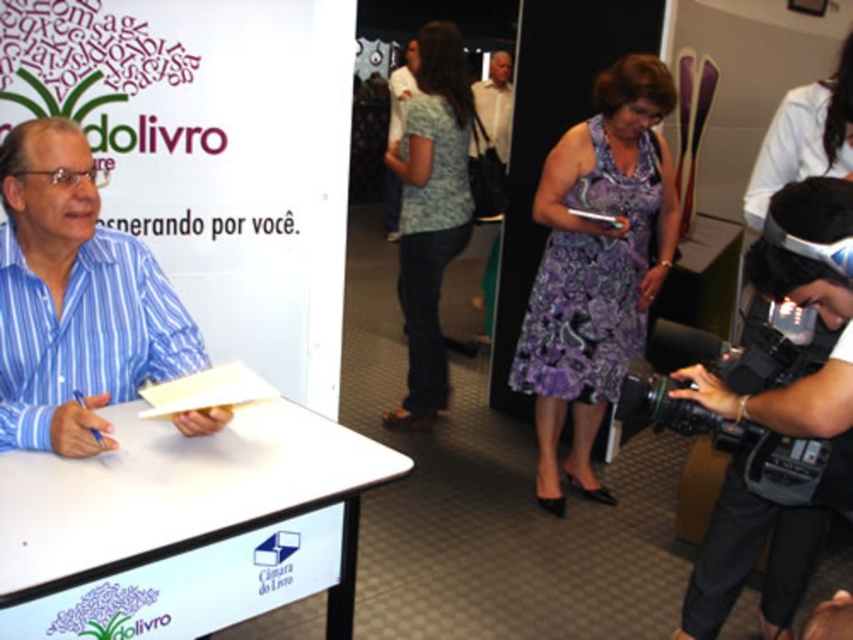
The image size is (853, 640). What do you see at coordinates (74, 300) in the screenshot?
I see `blue striped shirt at left` at bounding box center [74, 300].

Who is more forward, (x=49, y=244) or (x=682, y=410)?

Point (x=49, y=244) is more forward.

Between point (13, 214) and point (686, 435), which one is positioned in front?

Point (13, 214)

Locate an element on the screen. The width and height of the screenshot is (853, 640). blue striped shirt at left is located at coordinates (74, 300).

From the picture: Between blue striped shirt at left and purple printed dress at center, which one appears on the right side from the viewer's perspective?

Positioned to the right is purple printed dress at center.

Between blue striped shirt at left and purple printed dress at center, which one has more height?

purple printed dress at center

Between point (4, 140) and point (547, 372), which one is positioned behind?

The point (547, 372) is more distant.

Find the location of a particular element. Image resolution: width=853 pixels, height=640 pixels. blue striped shirt at left is located at coordinates (74, 300).

Which of these two, black plastic video camera at lower right or purple floral dress at center, stands shorter?

black plastic video camera at lower right is shorter.

What do you see at coordinates (747, 444) in the screenshot?
I see `black plastic video camera at lower right` at bounding box center [747, 444].

Between point (653, 406) and point (776, 141), which one is positioned behind?

The point (776, 141) is behind.

Find the location of a particular element. The image size is (853, 640). black plastic video camera at lower right is located at coordinates (747, 444).